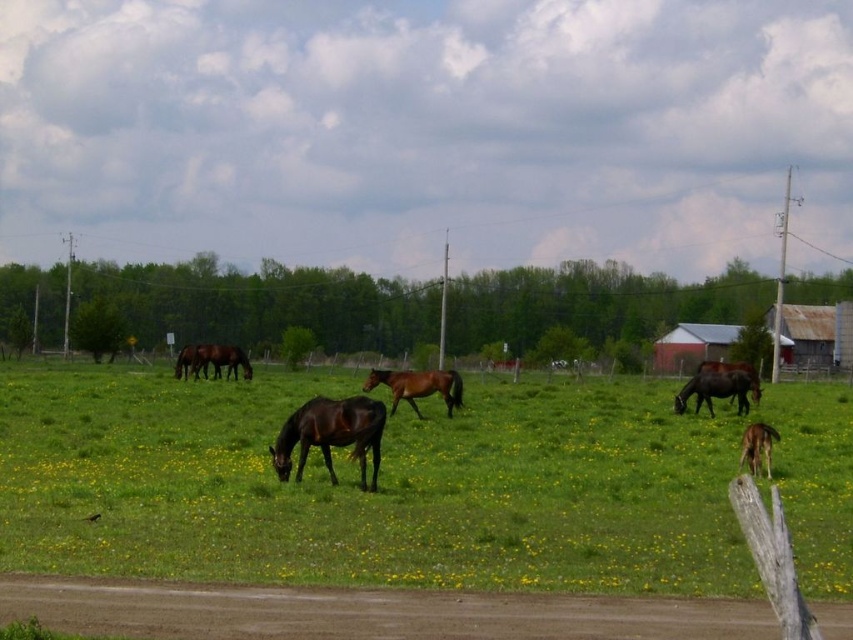
You are standing at the dirt path in the foreground of the scene. You see two points marked in the image, point 1 at coordinates point (227,500) and point 2 at coordinates point (288,468). Which point is closer to you?

Point (227,500) is closer to the camera than point (288,468), so the point closer to you is point (227,500).

You are a photographer standing on the dirt path at the bottom of the image. You want to capture a photo of the shiny brown horse at center and the green grass pasture at center in the same frame. Which object should be placed to the left in your photo?

The shiny brown horse at center should be placed to the left of the green grass pasture at center in your photo because the green grass pasture at center is positioned on the right side of the shiny brown horse at center.

You are a photographer standing on the dirt path at the bottom of the image. You want to take a photo of both the shiny brown horse at center and the brown glossy horse at lower right. Which horse will appear higher in your photo?

The shiny brown horse at center will appear higher in your photo because it is located above the brown glossy horse at lower right.